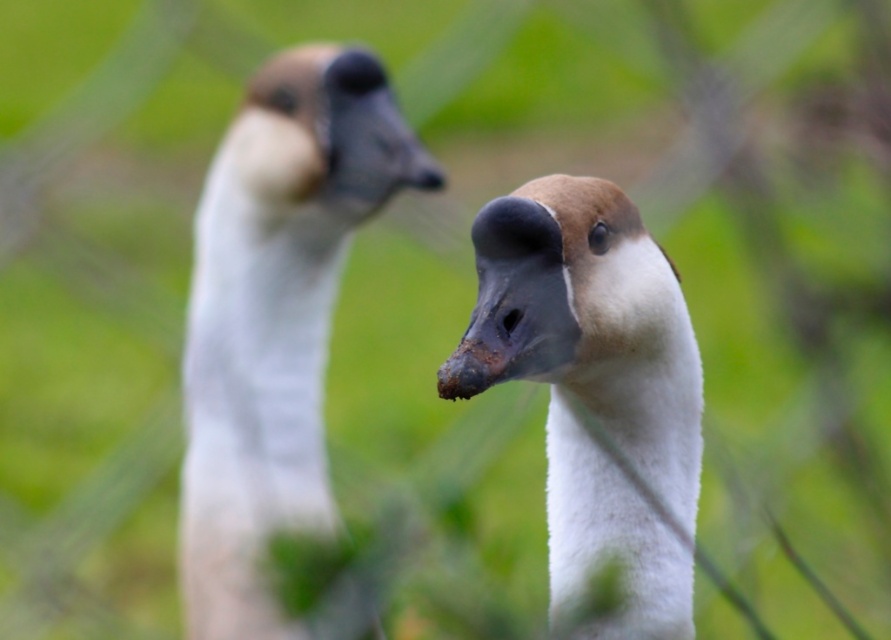
You are a wildlife photographer trying to capture the brown matte goose head at center and the brown matte beak at center in a clear shot. Which object should you adjust your focus on to ensure the taller one is sharp?

The brown matte goose head at center is much taller than the brown matte beak at center, so you should adjust your focus on the brown matte goose head at center to ensure it is sharp.

You are a photographer trying to capture the brown matte goose head at center and the brown matte beak at center in focus. Which object should you adjust your camera focus on to ensure both are sharp?

The brown matte goose head at center is in front of the brown matte beak at center. To ensure both are in focus, you should focus on the brown matte beak at center since it is closer to the camera.